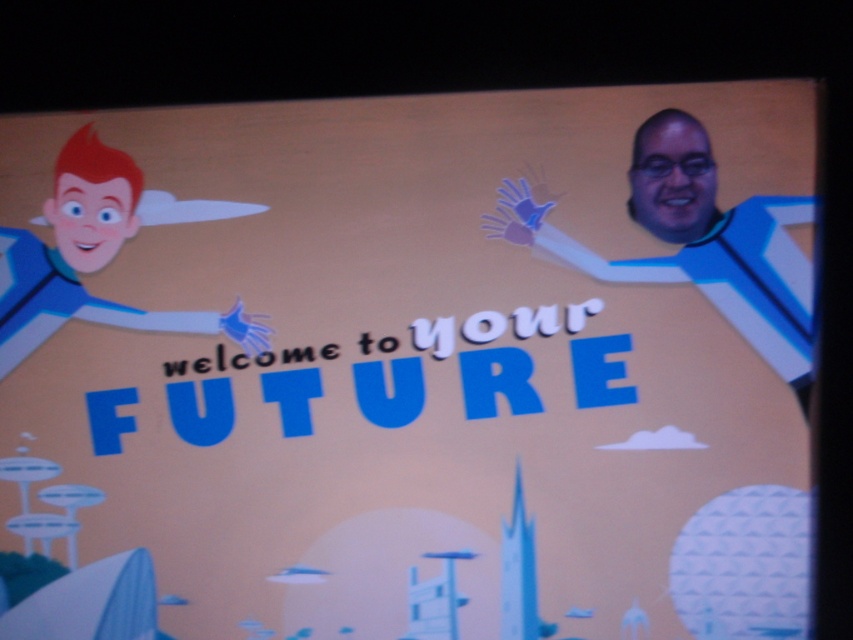
You are a character in the image and want to move from the cartoon character on the left to the blue plastic man at right. What direction should you move in?

You should move to the right to reach the blue plastic man at right from the cartoon character on the left.

You are an astronaut preparing for a mission and need to choose between the blue plastic man at right and the smooth blue suit at left. Based on their sizes, which one would be more suitable for wearing as a spacesuit?

The blue plastic man at right is larger in size than the smooth blue suit at left, so the blue plastic man at right would be more suitable for wearing as a spacesuit since it is bigger and likely fits better.